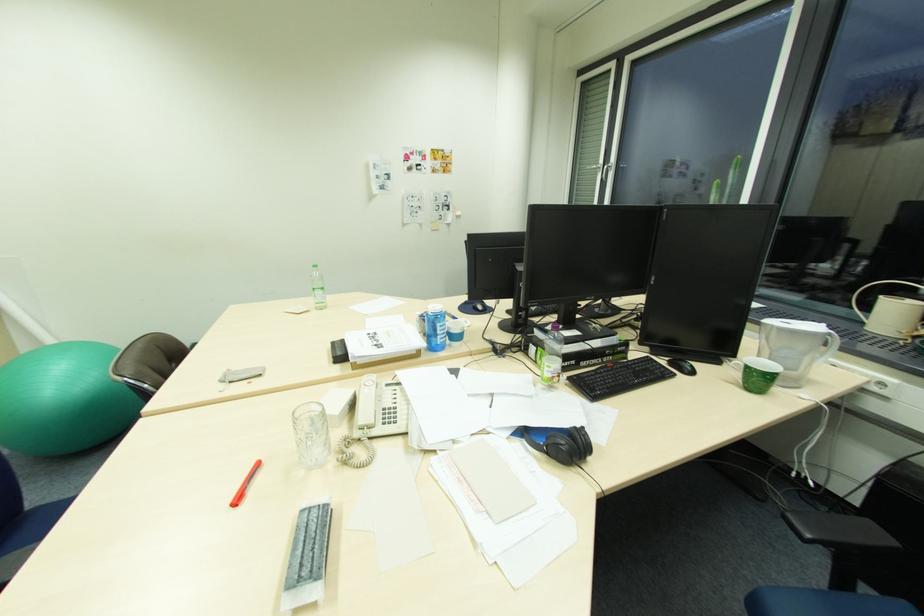
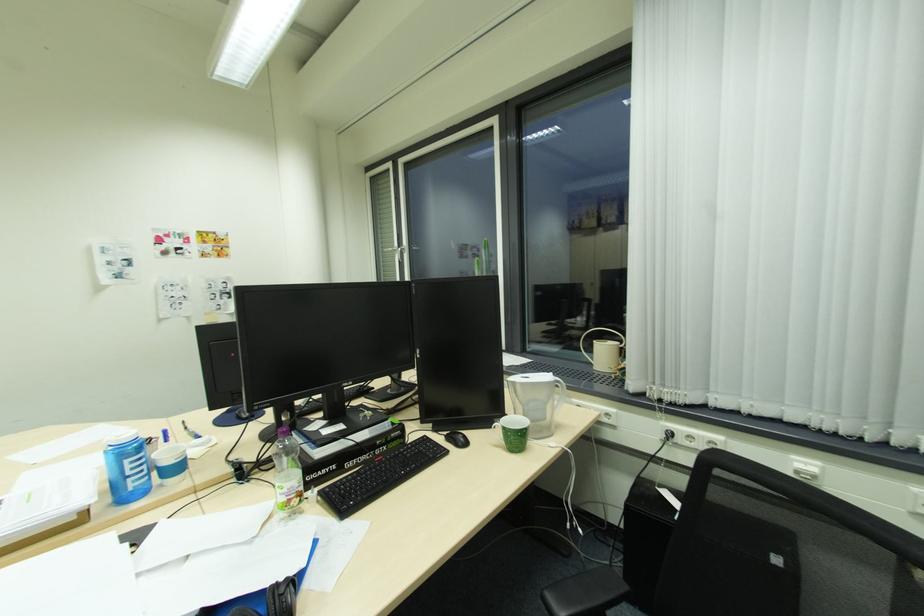
Find the pixel in the second image that matches point 573,383 in the first image.

(324, 499)